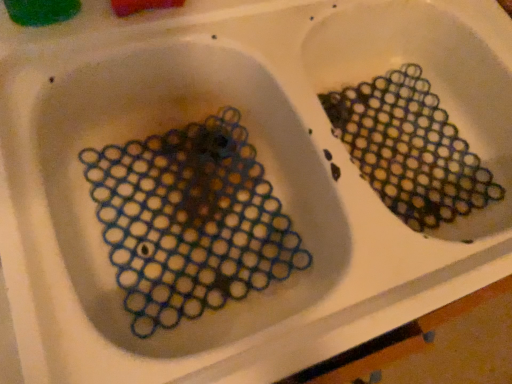
This screenshot has width=512, height=384. Describe the element at coordinates (410, 149) in the screenshot. I see `translucent plastic mesh at upper right, the first debris in the right-to-left sequence` at that location.

Where is `translucent plastic mesh at upper right, the first debris in the right-to-left sequence`? This screenshot has height=384, width=512. translucent plastic mesh at upper right, the first debris in the right-to-left sequence is located at coordinates (410, 149).

In order to face translucent plastic mesh at upper right, the second debris in the left-to-right sequence, should I rotate leftwards or rightwards?

To face it directly, rotate right by 18.184 degrees.

This screenshot has height=384, width=512. Find the location of `translucent plastic mesh at left, marked as the 1th debris in a left-to-right arrangement`. translucent plastic mesh at left, marked as the 1th debris in a left-to-right arrangement is located at coordinates (190, 221).

The height and width of the screenshot is (384, 512). What do you see at coordinates (190, 221) in the screenshot?
I see `translucent plastic mesh at left, the second debris when ordered from right to left` at bounding box center [190, 221].

I want to click on translucent plastic mesh at upper right, the first debris in the right-to-left sequence, so click(x=410, y=149).

Is translucent plastic mesh at upper right, the first debris in the right-to-left sequence, to the left or to the right of translucent plastic mesh at left, the second debris when ordered from right to left, in the image?

translucent plastic mesh at upper right, the first debris in the right-to-left sequence, is positioned on translucent plastic mesh at left, the second debris when ordered from right to left,'s right side.

Considering their positions, is translucent plastic mesh at upper right, the first debris in the right-to-left sequence, located in front of or behind translucent plastic mesh at left, marked as the 1th debris in a left-to-right arrangement?

Visually, translucent plastic mesh at upper right, the first debris in the right-to-left sequence, is located behind translucent plastic mesh at left, marked as the 1th debris in a left-to-right arrangement.

Which is closer, (450, 217) or (262, 241)?

The point (262, 241) is closer.

From the image's perspective, is translucent plastic mesh at upper right, the second debris in the left-to-right sequence, located above or below translucent plastic mesh at left, marked as the 1th debris in a left-to-right arrangement?

translucent plastic mesh at upper right, the second debris in the left-to-right sequence, is above translucent plastic mesh at left, marked as the 1th debris in a left-to-right arrangement.

From a real-world perspective, is translucent plastic mesh at upper right, the first debris in the right-to-left sequence, physically below translucent plastic mesh at left, marked as the 1th debris in a left-to-right arrangement?

Yes, from a real-world perspective, translucent plastic mesh at upper right, the first debris in the right-to-left sequence, is under translucent plastic mesh at left, marked as the 1th debris in a left-to-right arrangement.

Considering the sizes of objects translucent plastic mesh at upper right, the second debris in the left-to-right sequence, and translucent plastic mesh at left, marked as the 1th debris in a left-to-right arrangement, in the image provided, who is thinner, translucent plastic mesh at upper right, the second debris in the left-to-right sequence, or translucent plastic mesh at left, marked as the 1th debris in a left-to-right arrangement,?

With smaller width is translucent plastic mesh at upper right, the second debris in the left-to-right sequence.

Who is taller, translucent plastic mesh at upper right, the second debris in the left-to-right sequence, or translucent plastic mesh at left, the second debris when ordered from right to left?

With more height is translucent plastic mesh at left, the second debris when ordered from right to left.

Who is bigger, translucent plastic mesh at upper right, the second debris in the left-to-right sequence, or translucent plastic mesh at left, the second debris when ordered from right to left?

With larger size is translucent plastic mesh at left, the second debris when ordered from right to left.

Is translucent plastic mesh at upper right, the first debris in the right-to-left sequence, not inside translucent plastic mesh at left, marked as the 1th debris in a left-to-right arrangement?

translucent plastic mesh at upper right, the first debris in the right-to-left sequence, is positioned outside translucent plastic mesh at left, marked as the 1th debris in a left-to-right arrangement.

Is translucent plastic mesh at upper right, the first debris in the right-to-left sequence, far away from translucent plastic mesh at left, marked as the 1th debris in a left-to-right arrangement?

No, there isn't a large distance between translucent plastic mesh at upper right, the first debris in the right-to-left sequence, and translucent plastic mesh at left, marked as the 1th debris in a left-to-right arrangement.

Is translucent plastic mesh at upper right, the first debris in the right-to-left sequence, facing towards translucent plastic mesh at left, the second debris when ordered from right to left?

No, translucent plastic mesh at upper right, the first debris in the right-to-left sequence, is not turned towards translucent plastic mesh at left, the second debris when ordered from right to left.

How different are the orientations of translucent plastic mesh at upper right, the second debris in the left-to-right sequence, and translucent plastic mesh at left, marked as the 1th debris in a left-to-right arrangement, in degrees?

They differ by 0.000308 degrees in their facing directions.

Measure the distance between translucent plastic mesh at upper right, the first debris in the right-to-left sequence, and translucent plastic mesh at left, the second debris when ordered from right to left.

translucent plastic mesh at upper right, the first debris in the right-to-left sequence, is 27.75 centimeters away from translucent plastic mesh at left, the second debris when ordered from right to left.

I want to click on debris lying above the translucent plastic mesh at left, marked as the 1th debris in a left-to-right arrangement (from the image's perspective), so click(410, 149).

Is translucent plastic mesh at left, marked as the 1th debris in a left-to-right arrangement, to the right of translucent plastic mesh at upper right, the first debris in the right-to-left sequence, from the viewer's perspective?

No.

Is translucent plastic mesh at left, the second debris when ordered from right to left, behind translucent plastic mesh at upper right, the first debris in the right-to-left sequence?

No.

Does point (142, 164) lie in front of point (344, 97)?

Yes, point (142, 164) is in front of point (344, 97).

From the image's perspective, who appears lower, translucent plastic mesh at left, the second debris when ordered from right to left, or translucent plastic mesh at upper right, the first debris in the right-to-left sequence?

translucent plastic mesh at left, the second debris when ordered from right to left, from the image's perspective.

From a real-world perspective, is translucent plastic mesh at left, marked as the 1th debris in a left-to-right arrangement, positioned over translucent plastic mesh at upper right, the second debris in the left-to-right sequence, based on gravity?

Correct, in the physical world, translucent plastic mesh at left, marked as the 1th debris in a left-to-right arrangement, is higher than translucent plastic mesh at upper right, the second debris in the left-to-right sequence.

Which of these two, translucent plastic mesh at left, the second debris when ordered from right to left, or translucent plastic mesh at upper right, the second debris in the left-to-right sequence, is wider?

translucent plastic mesh at left, the second debris when ordered from right to left.

Consider the image. Between translucent plastic mesh at left, marked as the 1th debris in a left-to-right arrangement, and translucent plastic mesh at upper right, the first debris in the right-to-left sequence, which one has less height?

translucent plastic mesh at upper right, the first debris in the right-to-left sequence, is shorter.

Between translucent plastic mesh at left, marked as the 1th debris in a left-to-right arrangement, and translucent plastic mesh at upper right, the first debris in the right-to-left sequence, which one has larger size?

Bigger between the two is translucent plastic mesh at left, marked as the 1th debris in a left-to-right arrangement.

Is translucent plastic mesh at left, the second debris when ordered from right to left, situated inside translucent plastic mesh at upper right, the second debris in the left-to-right sequence, or outside?

translucent plastic mesh at left, the second debris when ordered from right to left, is not inside translucent plastic mesh at upper right, the second debris in the left-to-right sequence, it's outside.

Does translucent plastic mesh at left, marked as the 1th debris in a left-to-right arrangement, touch translucent plastic mesh at upper right, the first debris in the right-to-left sequence?

They are not placed beside each other.

Is translucent plastic mesh at left, the second debris when ordered from right to left, oriented away from translucent plastic mesh at upper right, the second debris in the left-to-right sequence?

No, translucent plastic mesh at left, the second debris when ordered from right to left,'s orientation is not away from translucent plastic mesh at upper right, the second debris in the left-to-right sequence.

Can you tell me how much translucent plastic mesh at left, the second debris when ordered from right to left, and translucent plastic mesh at upper right, the first debris in the right-to-left sequence, differ in facing direction?

0.000308 degrees separate the facing orientations of translucent plastic mesh at left, the second debris when ordered from right to left, and translucent plastic mesh at upper right, the first debris in the right-to-left sequence.

Locate an element on the screen. debris that is under the translucent plastic mesh at left, marked as the 1th debris in a left-to-right arrangement (from a real-world perspective) is located at coordinates (410, 149).

Identify the location of debris below the translucent plastic mesh at left, the second debris when ordered from right to left (from a real-world perspective). (410, 149).

At what (x,y) coordinates should I click in order to perform the action: click on debris that appears on the right of translucent plastic mesh at left, the second debris when ordered from right to left. Please return your answer as a coordinate pair (x, y). The height and width of the screenshot is (384, 512). Looking at the image, I should click on (410, 149).